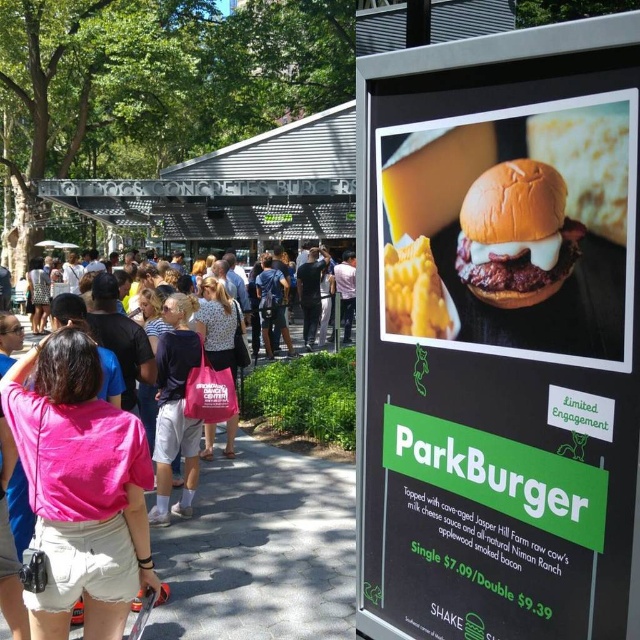
You are a customer at the food stand and want to grab both the shiny golden cheeseburger at center and the pink fabric bag at center. Which one should you reach for first to get the one on the left?

The pink fabric bag at center is on the left side of the shiny golden cheeseburger at center, so you should reach for the pink fabric bag at center first.